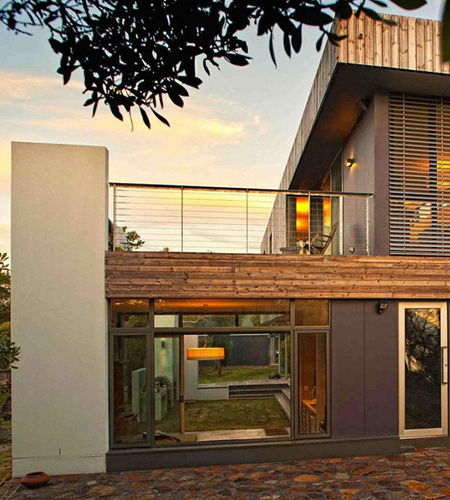
Locate an element on the screen. This screenshot has height=500, width=450. blinds is located at coordinates (401, 170).